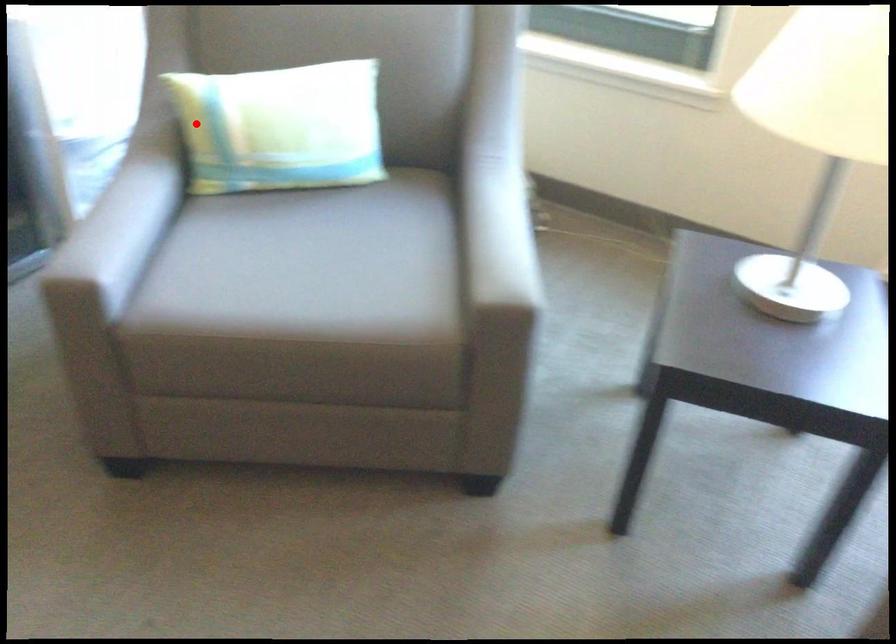
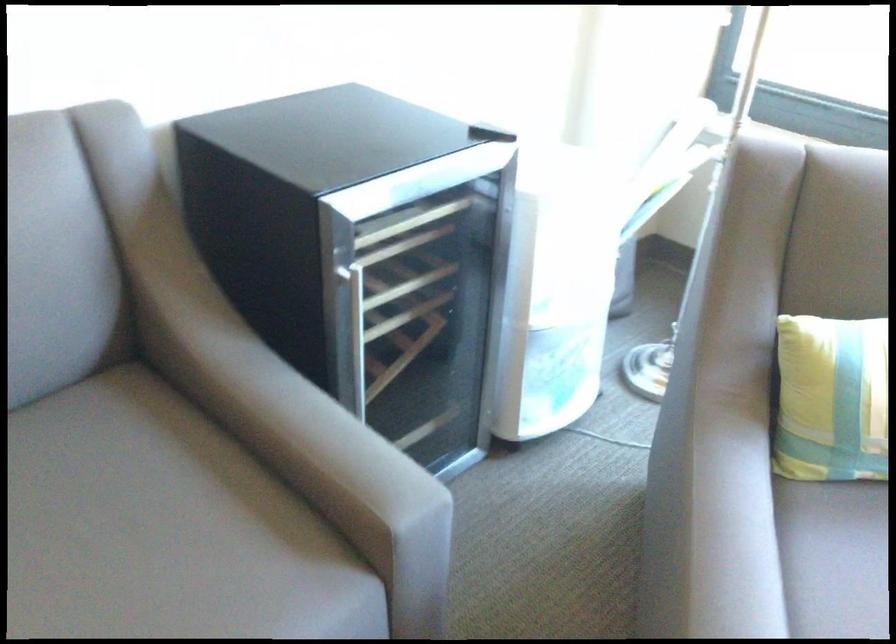
Find the pixel in the second image that matches the highlighted location in the first image.

(831, 399)